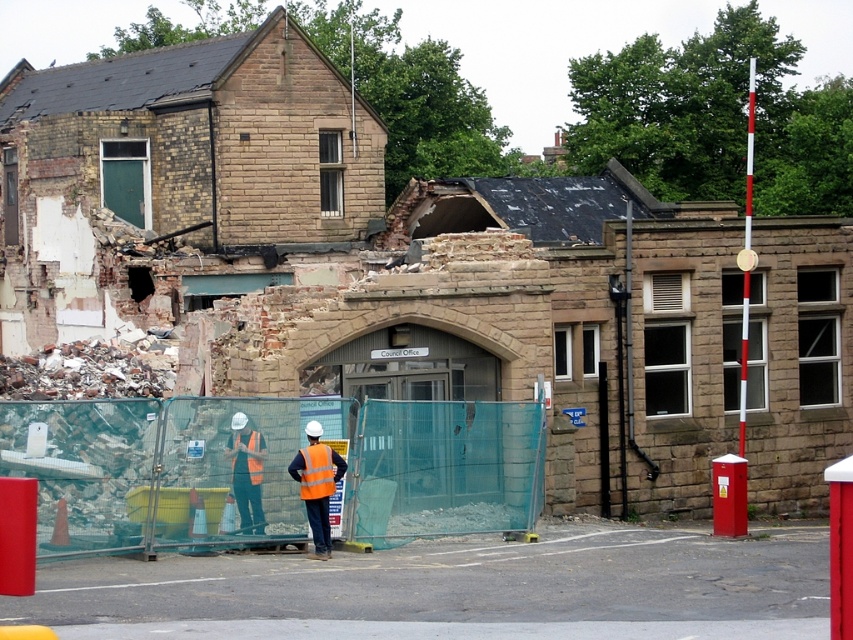
Question: Among these objects, which one is farthest from the camera?

Choices:
 (A) hi-visibility fabric safety vest at center
 (B) orange reflective vest at center
 (C) orange reflective safety vest at center
 (D) high visibility vest at center

Answer: (C)

Question: Which point is farther to the camera?

Choices:
 (A) hi-visibility fabric safety vest at center
 (B) orange reflective safety vest at center
 (C) orange reflective vest at center

Answer: (B)

Question: Can you confirm if high visibility vest at center is positioned above orange reflective safety vest at center?

Choices:
 (A) no
 (B) yes

Answer: (A)

Question: Does orange reflective vest at center have a smaller size compared to orange reflective safety vest at center?

Choices:
 (A) no
 (B) yes

Answer: (A)

Question: Which point is closer to the camera taking this photo?

Choices:
 (A) (251, 458)
 (B) (332, 477)

Answer: (B)

Question: Can you confirm if orange reflective vest at center is positioned to the left of hi-visibility fabric safety vest at center?

Choices:
 (A) no
 (B) yes

Answer: (B)